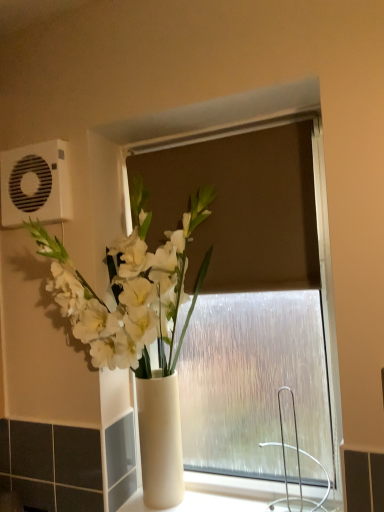
Question: Is white glossy vase at center facing towards white plastic air conditioning unit at upper left?

Choices:
 (A) no
 (B) yes

Answer: (A)

Question: Can you confirm if white glossy vase at center is shorter than white plastic air conditioning unit at upper left?

Choices:
 (A) no
 (B) yes

Answer: (A)

Question: Considering the relative sizes of white glossy vase at center and white plastic air conditioning unit at upper left in the image provided, is white glossy vase at center thinner than white plastic air conditioning unit at upper left?

Choices:
 (A) no
 (B) yes

Answer: (A)

Question: Is white glossy vase at center positioned with its back to white plastic air conditioning unit at upper left?

Choices:
 (A) no
 (B) yes

Answer: (A)

Question: Is white glossy vase at center not inside white plastic air conditioning unit at upper left?

Choices:
 (A) no
 (B) yes

Answer: (B)

Question: From the image's perspective, would you say white glossy vase at center is shown under white plastic air conditioning unit at upper left?

Choices:
 (A) yes
 (B) no

Answer: (A)

Question: Considering the relative sizes of white plastic air conditioning unit at upper left and white glossy vase at center in the image provided, is white plastic air conditioning unit at upper left thinner than white glossy vase at center?

Choices:
 (A) no
 (B) yes

Answer: (B)

Question: Is white plastic air conditioning unit at upper left oriented away from white glossy vase at center?

Choices:
 (A) no
 (B) yes

Answer: (A)

Question: From the image's perspective, does white plastic air conditioning unit at upper left appear lower than white glossy vase at center?

Choices:
 (A) yes
 (B) no

Answer: (B)

Question: Does white plastic air conditioning unit at upper left lie in front of white glossy vase at center?

Choices:
 (A) no
 (B) yes

Answer: (A)

Question: Considering the relative sizes of white plastic air conditioning unit at upper left and white glossy vase at center in the image provided, is white plastic air conditioning unit at upper left taller than white glossy vase at center?

Choices:
 (A) no
 (B) yes

Answer: (A)

Question: Is white plastic air conditioning unit at upper left bigger than white glossy vase at center?

Choices:
 (A) no
 (B) yes

Answer: (A)

Question: Would you say white glossy vase at center is to the left or to the right of white plastic air conditioning unit at upper left in the picture?

Choices:
 (A) right
 (B) left

Answer: (A)